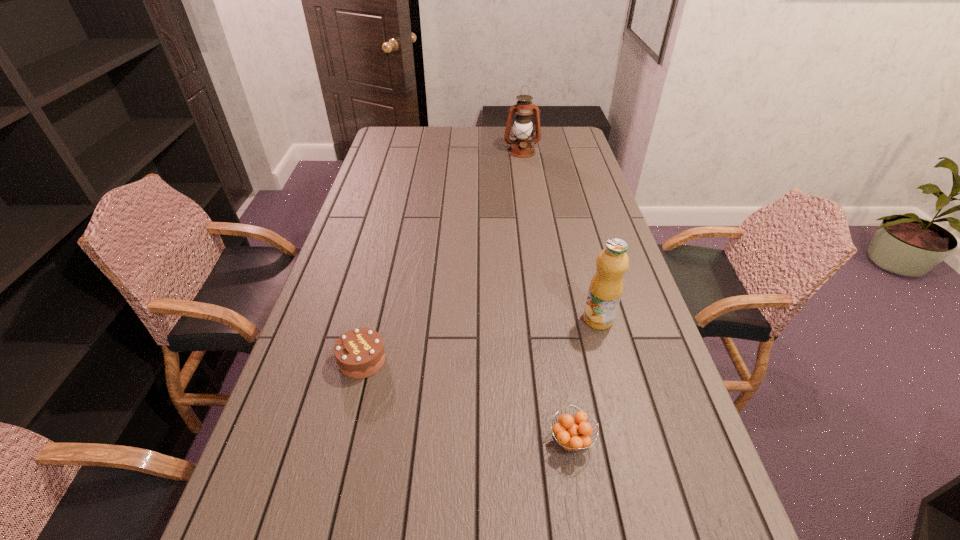
You are a GUI agent. You are given a task and a screenshot of the screen. Output one action in this format:
    pyautogui.click(x=<x>, y=<y>)
    Task: Click on the farthest object
    This screenshot has width=960, height=540.
    Given the screenshot: What is the action you would take?
    pyautogui.click(x=521, y=147)

This screenshot has width=960, height=540. In order to click on the rightmost object in this screenshot , I will do `click(606, 286)`.

You are a GUI agent. You are given a task and a screenshot of the screen. Output one action in this format:
    pyautogui.click(x=<x>, y=<y>)
    Task: Click on the fruit juice
    
    Given the screenshot: What is the action you would take?
    pyautogui.click(x=606, y=286)

Where is `the leftmost object`? This screenshot has width=960, height=540. the leftmost object is located at coordinates (359, 353).

Identify the location of chocolate cake. The image size is (960, 540). (359, 353).

Find the location of a particular element. The image size is (960, 540). the shortest object is located at coordinates (576, 434).

Identify the location of the nearest object. This screenshot has width=960, height=540. (576, 434).

Identify the location of free space located 0.360m on the side of the farthest object, there is a wick adjustment knob. The width and height of the screenshot is (960, 540). [530, 204].

Where is `vacant point located 0.160m on the front label of the rightmost object`? This screenshot has height=540, width=960. vacant point located 0.160m on the front label of the rightmost object is located at coordinates (614, 381).

Find the location of a particular element. vacant area located on the front of the second shortest object is located at coordinates (342, 448).